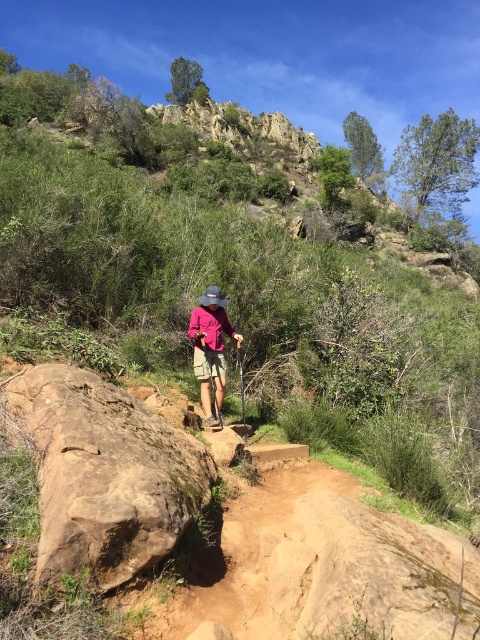
Can you confirm if brown rough rock at lower left is thinner than pink fabric hat at center?

Incorrect, brown rough rock at lower left's width is not less than pink fabric hat at center's.

Image resolution: width=480 pixels, height=640 pixels. What do you see at coordinates (104, 474) in the screenshot?
I see `brown rough rock at lower left` at bounding box center [104, 474].

The image size is (480, 640). What are the coordinates of `brown rough rock at lower left` in the screenshot? It's located at (104, 474).